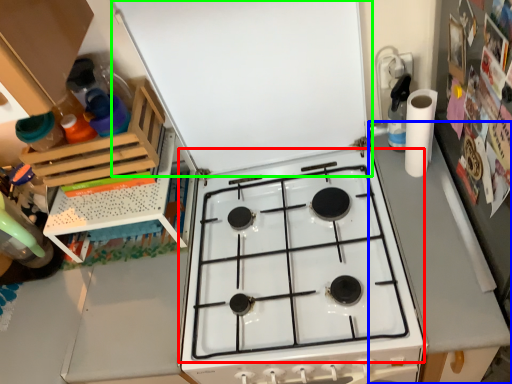
Question: Which object is the closest to the gas stove (highlighted by a red box)? Choose among these: counter top (highlighted by a blue box) or exhaust hood (highlighted by a green box).

Choices:
 (A) counter top
 (B) exhaust hood

Answer: (A)